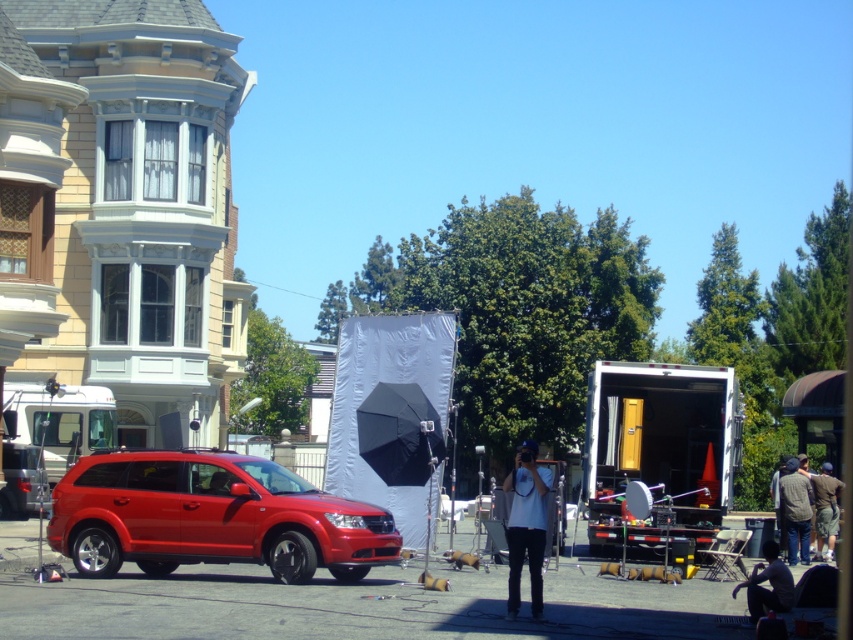
Question: Estimate the real-world distances between objects in this image. Which object is farther from the shiny red suv at center?

Choices:
 (A) dark gray sweater at lower right
 (B) dark gray shorts at lower right

Answer: (B)

Question: Considering the relative positions of shiny red suv at center and dark gray shorts at lower right in the image provided, where is shiny red suv at center located with respect to dark gray shorts at lower right?

Choices:
 (A) left
 (B) right

Answer: (A)

Question: Which object is positioned closest to the dark gray sweater at lower right?

Choices:
 (A) dark gray fabric at lower right
 (B) dark gray shorts at lower right
 (C) shiny red suv at center
 (D) white matte shirt at center

Answer: (B)

Question: Which object is positioned closest to the dark gray shorts at lower right?

Choices:
 (A) dark gray sweater at lower right
 (B) white matte shirt at center

Answer: (A)

Question: Does white matte shirt at center lie in front of dark gray shorts at lower right?

Choices:
 (A) no
 (B) yes

Answer: (B)

Question: Does dark gray sweater at lower right appear under dark gray fabric at lower right?

Choices:
 (A) no
 (B) yes

Answer: (B)